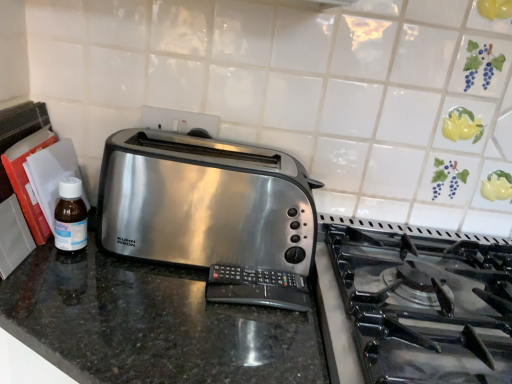
What is the approximate height of translucent plastic bottle at left?

12.73 centimeters.

This screenshot has width=512, height=384. Find the location of `translucent plastic bottle at left`. translucent plastic bottle at left is located at coordinates (70, 217).

Image resolution: width=512 pixels, height=384 pixels. Find the location of `toaster that is on the right side of translucent plastic bottle at left`. toaster that is on the right side of translucent plastic bottle at left is located at coordinates (211, 213).

Considering the sizes of objects satin metallic toaster at center and translucent plastic bottle at left in the image provided, who is taller, satin metallic toaster at center or translucent plastic bottle at left?

With more height is satin metallic toaster at center.

From the image's perspective, is satin metallic toaster at center on translucent plastic bottle at left?

Indeed, from the image's perspective, satin metallic toaster at center is shown above translucent plastic bottle at left.

Is satin metallic toaster at center looking in the opposite direction of translucent plastic bottle at left?

No, translucent plastic bottle at left is not at the back of satin metallic toaster at center.

Are shiny granite counter at center and satin metallic toaster at center located far from each other?

No, shiny granite counter at center is in close proximity to satin metallic toaster at center.

From a real-world perspective, does shiny granite counter at center stand above satin metallic toaster at center?

No, from a real-world perspective, shiny granite counter at center is not over satin metallic toaster at center

Is shiny granite counter at center outside of satin metallic toaster at center?

shiny granite counter at center lies outside satin metallic toaster at center's area.

Is satin metallic toaster at center not close to shiny granite counter at center?

That's not correct — satin metallic toaster at center is a little close to shiny granite counter at center.

At what (x,y) coordinates should I click in order to perform the action: click on counter that is under the satin metallic toaster at center (from a real-world perspective). Please return your answer as a coordinate pair (x, y). Looking at the image, I should click on (x=153, y=323).

From the image's perspective, which object appears higher, satin metallic toaster at center or shiny granite counter at center?

satin metallic toaster at center.

Considering the relative sizes of satin metallic toaster at center and shiny granite counter at center in the image provided, is satin metallic toaster at center wider than shiny granite counter at center?

In fact, satin metallic toaster at center might be narrower than shiny granite counter at center.

Which is in front, shiny granite counter at center or translucent plastic bottle at left?

Positioned in front is shiny granite counter at center.

Which is further, (196, 312) or (67, 241)?

Point (67, 241)

How different are the orientations of shiny granite counter at center and translucent plastic bottle at left in degrees?

The angle between the facing direction of shiny granite counter at center and the facing direction of translucent plastic bottle at left is 29.6 degrees.

Considering the sizes of objects shiny granite counter at center and translucent plastic bottle at left in the image provided, who is shorter, shiny granite counter at center or translucent plastic bottle at left?

Standing shorter between the two is translucent plastic bottle at left.

Is translucent plastic bottle at left positioned with its back to shiny granite counter at center?

translucent plastic bottle at left does not have its back to shiny granite counter at center.

Is shiny granite counter at center a part of translucent plastic bottle at left?

No, shiny granite counter at center is not surrounded by translucent plastic bottle at left.

From a real-world perspective, which object stands above the other?

In real-world perspective, translucent plastic bottle at left is above.

Based on the photo, considering the sizes of objects translucent plastic bottle at left and shiny granite counter at center in the image provided, who is thinner, translucent plastic bottle at left or shiny granite counter at center?

Thinner between the two is translucent plastic bottle at left.

Can you confirm if translucent plastic bottle at left is shorter than satin metallic toaster at center?

Yes.

You are a GUI agent. You are given a task and a screenshot of the screen. Output one action in this format:
    pyautogui.click(x=<x>, y=<y>)
    Task: Click on the bottle that is on the left side of satin metallic toaster at center
    Image resolution: width=512 pixels, height=384 pixels.
    Given the screenshot: What is the action you would take?
    pyautogui.click(x=70, y=217)

From a real-world perspective, is translucent plastic bottle at left positioned above or below satin metallic toaster at center?

From a real-world perspective, translucent plastic bottle at left is physically below satin metallic toaster at center.

Is translucent plastic bottle at left completely or partially outside of satin metallic toaster at center?

Yes, translucent plastic bottle at left is located beyond the bounds of satin metallic toaster at center.

Find the location of a particular element. This screenshot has width=512, height=384. bottle that appears behind the satin metallic toaster at center is located at coordinates (70, 217).

Locate an element on the screen. This screenshot has height=384, width=512. counter on the left side of satin metallic toaster at center is located at coordinates (153, 323).

From the image, which object appears to be farther from shiny granite counter at center, satin metallic toaster at center or translucent plastic bottle at left?

The object further to shiny granite counter at center is translucent plastic bottle at left.

Consider the image. Based on their spatial positions, is translucent plastic bottle at left or shiny granite counter at center closer to satin metallic toaster at center?

The object closer to satin metallic toaster at center is shiny granite counter at center.

Looking at the image, which one is located closer to shiny granite counter at center, translucent plastic bottle at left or satin metallic toaster at center?

satin metallic toaster at center lies closer to shiny granite counter at center than the other object.

From the image, which object appears to be nearer to translucent plastic bottle at left, shiny granite counter at center or satin metallic toaster at center?

shiny granite counter at center is closer to translucent plastic bottle at left.

Based on their spatial positions, is satin metallic toaster at center or shiny granite counter at center further from translucent plastic bottle at left?

satin metallic toaster at center lies further to translucent plastic bottle at left than the other object.

Looking at the image, which one is located closer to satin metallic toaster at center, shiny granite counter at center or translucent plastic bottle at left?

shiny granite counter at center is positioned closer to the anchor satin metallic toaster at center.

Find the location of a particular element. bottle between satin metallic toaster at center and shiny granite counter at center vertically is located at coordinates (70, 217).